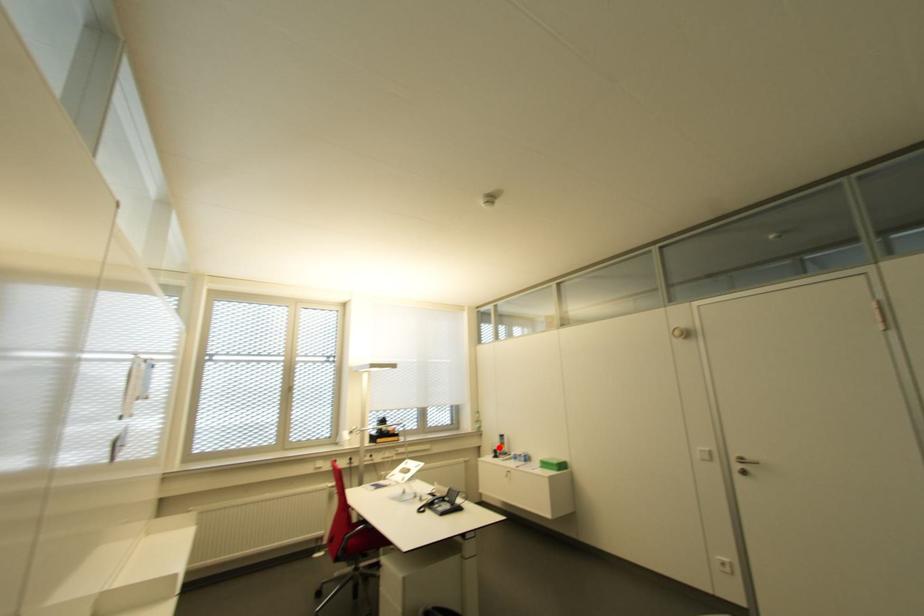
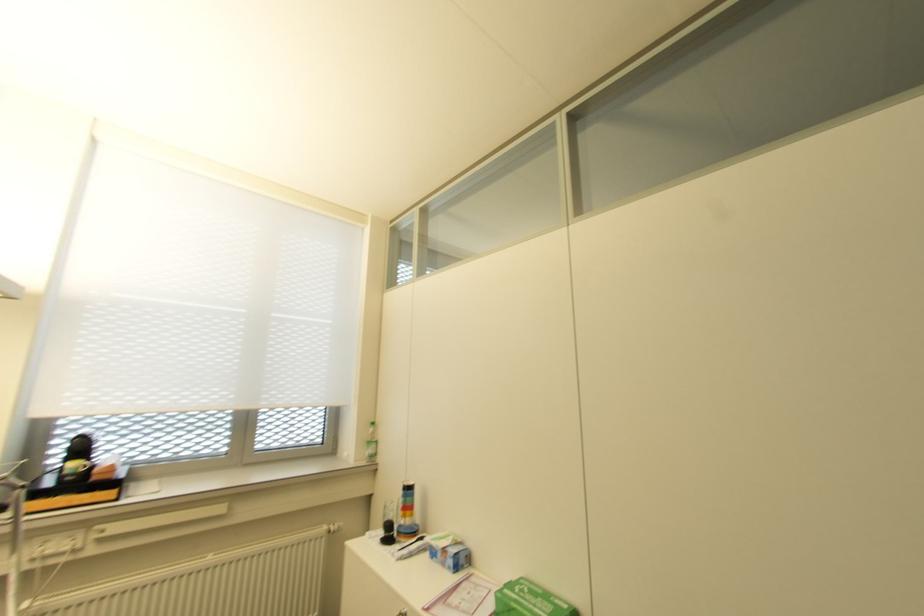
Find the pixel in the second image that matches the highlighted location in the first image.

(402, 517)